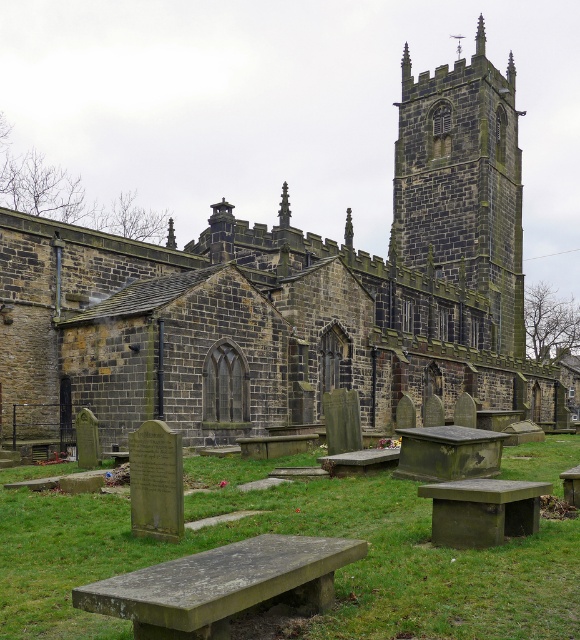
Is dark gray stone church at center further to the viewer compared to rustic wooden bench at center?

Yes.

Which is in front, point (103, 241) or point (358, 472)?

Point (358, 472) is more forward.

You are a GUI agent. You are given a task and a screenshot of the screen. Output one action in this format:
    pyautogui.click(x=<x>, y=<y>)
    Task: Click on the dark gray stone church at center
    The image size is (580, 640).
    Given the screenshot: What is the action you would take?
    pyautogui.click(x=290, y=298)

Consider the image. Between green moss-covered bench at center and wooden bench at lower right, which one has more height?

wooden bench at lower right is taller.

Does point (291, 435) lie behind point (571, 474)?

Yes, it is behind point (571, 474).

Where is `green moss-covered bench at center`? green moss-covered bench at center is located at coordinates (276, 444).

Is green mossy stone bench at center wider than wooden bench at lower right?

Yes, green mossy stone bench at center is wider than wooden bench at lower right.

Does green mossy stone bench at center have a lesser width compared to wooden bench at lower right?

In fact, green mossy stone bench at center might be wider than wooden bench at lower right.

Does point (454, 477) lie in front of point (567, 477)?

No, it is not.

The width and height of the screenshot is (580, 640). What are the coordinates of `green mossy stone bench at center` in the screenshot? It's located at (448, 452).